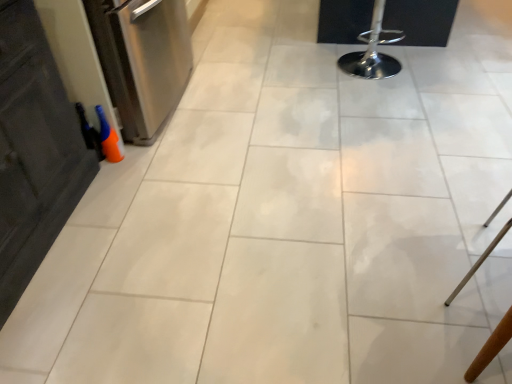
Where is `wooden chair at lower right`? The image size is (512, 384). wooden chair at lower right is located at coordinates (490, 347).

Image resolution: width=512 pixels, height=384 pixels. I want to click on polished chrome bar stool at upper right, so click(x=373, y=51).

From the picture: Which is behind, polished chrome bar stool at upper right or wooden chair at lower right?

polished chrome bar stool at upper right is behind.

Which object is positioned more to the right, polished chrome bar stool at upper right or wooden chair at lower right?

wooden chair at lower right.

Which of these two, polished chrome bar stool at upper right or wooden chair at lower right, is wider?

With larger width is polished chrome bar stool at upper right.

From a real-world perspective, is polished chrome bar stool at upper right physically located above or below wooden chair at lower right?

Clearly, from a real-world perspective, polished chrome bar stool at upper right is below wooden chair at lower right.

Find the location of a particular element. bar stool behind the wooden chair at lower right is located at coordinates (373, 51).

Is wooden chair at lower right in contact with polished chrome bar stool at upper right?

No, wooden chair at lower right is not with polished chrome bar stool at upper right.

Is wooden chair at lower right bigger or smaller than polished chrome bar stool at upper right?

Clearly, wooden chair at lower right is smaller in size than polished chrome bar stool at upper right.

Considering the sizes of wooden chair at lower right and polished chrome bar stool at upper right in the image, is wooden chair at lower right wider or thinner than polished chrome bar stool at upper right?

Considering their sizes, wooden chair at lower right looks slimmer than polished chrome bar stool at upper right.

Is wooden chair at lower right far from stainless steel dishwasher at left?

Absolutely, wooden chair at lower right is distant from stainless steel dishwasher at left.

Can you confirm if wooden chair at lower right is taller than stainless steel dishwasher at left?

In fact, wooden chair at lower right may be shorter than stainless steel dishwasher at left.

What's the angular difference between wooden chair at lower right and stainless steel dishwasher at left's facing directions?

The angle between the facing direction of wooden chair at lower right and the facing direction of stainless steel dishwasher at left is 28.7 degrees.

Would you say wooden chair at lower right is to the left or to the right of stainless steel dishwasher at left in the picture?

wooden chair at lower right is to the right of stainless steel dishwasher at left.

Can you see polished chrome bar stool at upper right touching stainless steel dishwasher at left?

No.

From a real-world perspective, which is physically below, polished chrome bar stool at upper right or stainless steel dishwasher at left?

In real-world perspective, polished chrome bar stool at upper right is lower.

Is stainless steel dishwasher at left inside the boundaries of polished chrome bar stool at upper right, or outside?

stainless steel dishwasher at left lies outside polished chrome bar stool at upper right.

Image resolution: width=512 pixels, height=384 pixels. Find the location of `dish washer lying on the left of polished chrome bar stool at upper right`. dish washer lying on the left of polished chrome bar stool at upper right is located at coordinates coord(142,60).

Are stainless steel dishwasher at left and polished chrome bar stool at upper right beside each other?

No, stainless steel dishwasher at left is not beside polished chrome bar stool at upper right.

Based on the photo, between stainless steel dishwasher at left and polished chrome bar stool at upper right, which one is positioned in front?

stainless steel dishwasher at left is more forward.

Considering the relative sizes of stainless steel dishwasher at left and wooden chair at lower right in the image provided, is stainless steel dishwasher at left taller than wooden chair at lower right?

Indeed, stainless steel dishwasher at left has a greater height compared to wooden chair at lower right.

Considering the points (187, 26) and (497, 339), which point is in front, point (187, 26) or point (497, 339)?

The point (497, 339) is closer.

Considering the positions of objects stainless steel dishwasher at left and wooden chair at lower right in the image provided, who is more to the left, stainless steel dishwasher at left or wooden chair at lower right?

stainless steel dishwasher at left is more to the left.

Could wooden chair at lower right be considered to be inside stainless steel dishwasher at left?

Actually, wooden chair at lower right is outside stainless steel dishwasher at left.

This screenshot has width=512, height=384. I want to click on furniture that is on the right side of polished chrome bar stool at upper right, so click(x=490, y=347).

Where is `furniture that is in front of the polished chrome bar stool at upper right`? The width and height of the screenshot is (512, 384). furniture that is in front of the polished chrome bar stool at upper right is located at coordinates (490, 347).

When comparing their distances from wooden chair at lower right, does polished chrome bar stool at upper right or stainless steel dishwasher at left seem further?

stainless steel dishwasher at left lies further to wooden chair at lower right than the other object.

When comparing their distances from stainless steel dishwasher at left, does polished chrome bar stool at upper right or wooden chair at lower right seem closer?

polished chrome bar stool at upper right.

Which object lies nearer to the anchor point wooden chair at lower right, stainless steel dishwasher at left or polished chrome bar stool at upper right?

polished chrome bar stool at upper right lies closer to wooden chair at lower right than the other object.

Based on their spatial positions, is stainless steel dishwasher at left or wooden chair at lower right closer to polished chrome bar stool at upper right?

The object closer to polished chrome bar stool at upper right is stainless steel dishwasher at left.

Which object lies nearer to the anchor point stainless steel dishwasher at left, wooden chair at lower right or polished chrome bar stool at upper right?

polished chrome bar stool at upper right.

Based on their spatial positions, is wooden chair at lower right or stainless steel dishwasher at left further from polished chrome bar stool at upper right?

wooden chair at lower right is positioned further to the anchor polished chrome bar stool at upper right.

Identify the location of bar stool between stainless steel dishwasher at left and wooden chair at lower right. (373, 51).